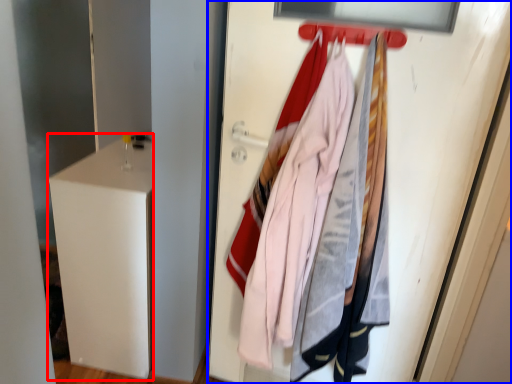
Question: Which of the following is the farthest to the observer, file cabinet (highlighted by a red box) or door (highlighted by a blue box)?

Choices:
 (A) file cabinet
 (B) door

Answer: (A)